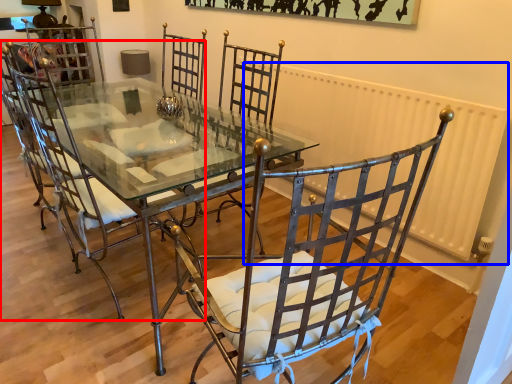
Question: Which object is closer to the camera taking this photo, chair (highlighted by a red box) or radiator (highlighted by a blue box)?

Choices:
 (A) chair
 (B) radiator

Answer: (A)